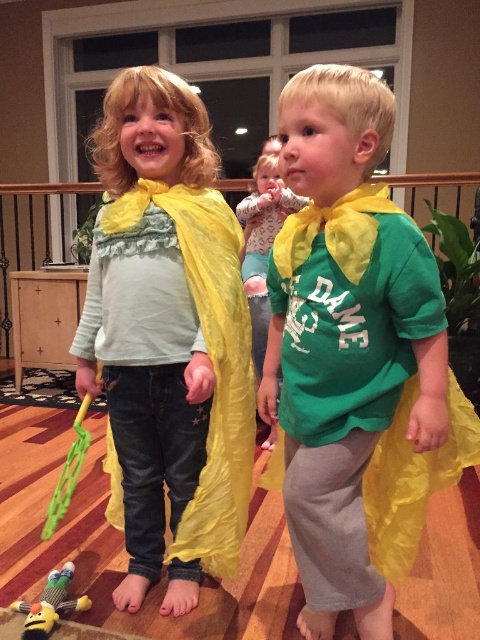
Question: Which object is the closest to the matte yellow cape at right?

Choices:
 (A) matte yellow cape at center
 (B) yellow silky cape at center
 (C) green plastic wand at lower left

Answer: (A)

Question: Is matte yellow cape at right positioned behind green plastic wand at lower left?

Choices:
 (A) no
 (B) yes

Answer: (A)

Question: Which of the following is the closest to the observer?

Choices:
 (A) matte yellow cape at center
 (B) yellow silky cape at center

Answer: (A)

Question: Which point appears closest to the camera in this image?

Choices:
 (A) (74, 456)
 (B) (242, 266)

Answer: (A)

Question: Is plush yellow bee at lower left below green plastic wand at lower left?

Choices:
 (A) no
 (B) yes

Answer: (B)

Question: Does plush yellow bee at lower left have a greater width compared to green plastic wand at lower left?

Choices:
 (A) yes
 (B) no

Answer: (A)